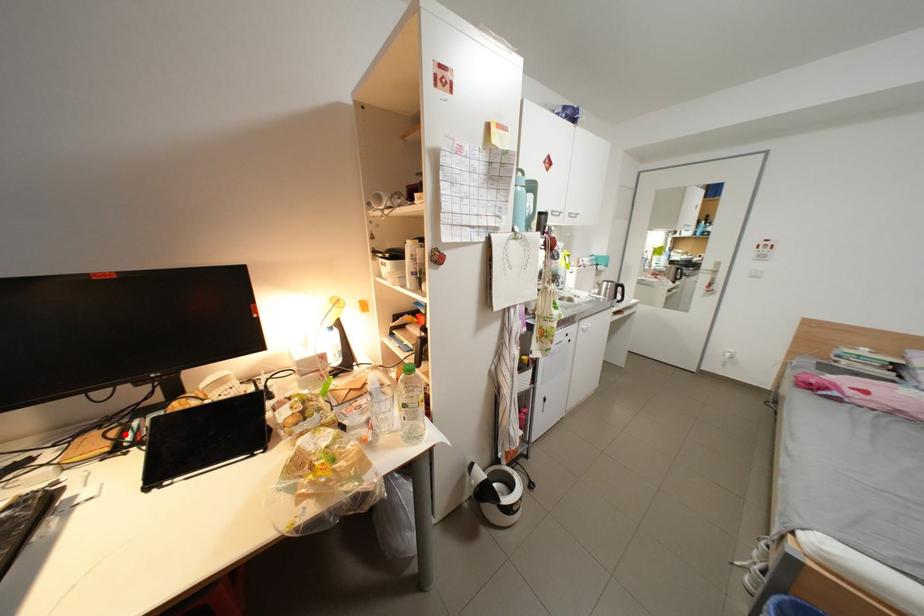
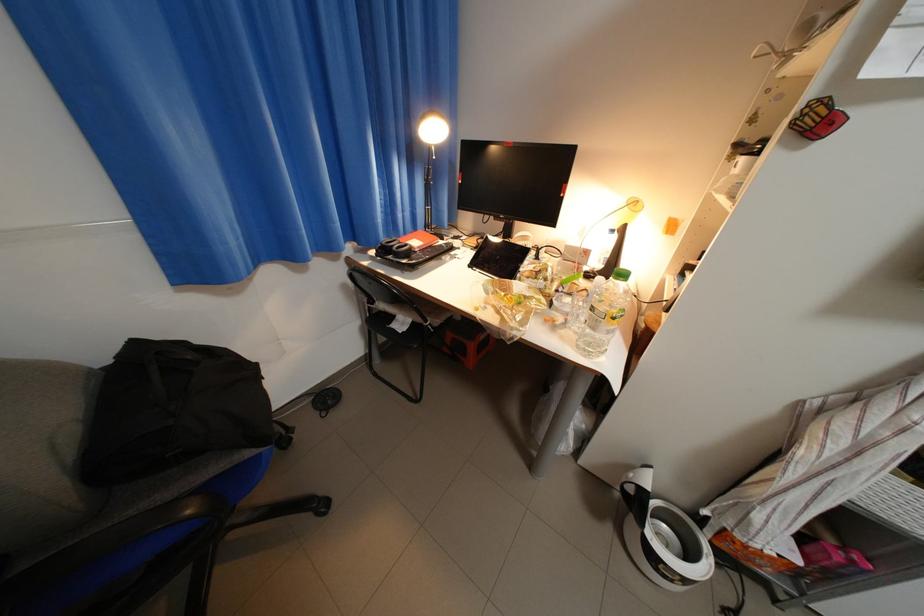
The point at the highlighted location is marked in the first image. Where is the corresponding point in the second image?

(492, 241)